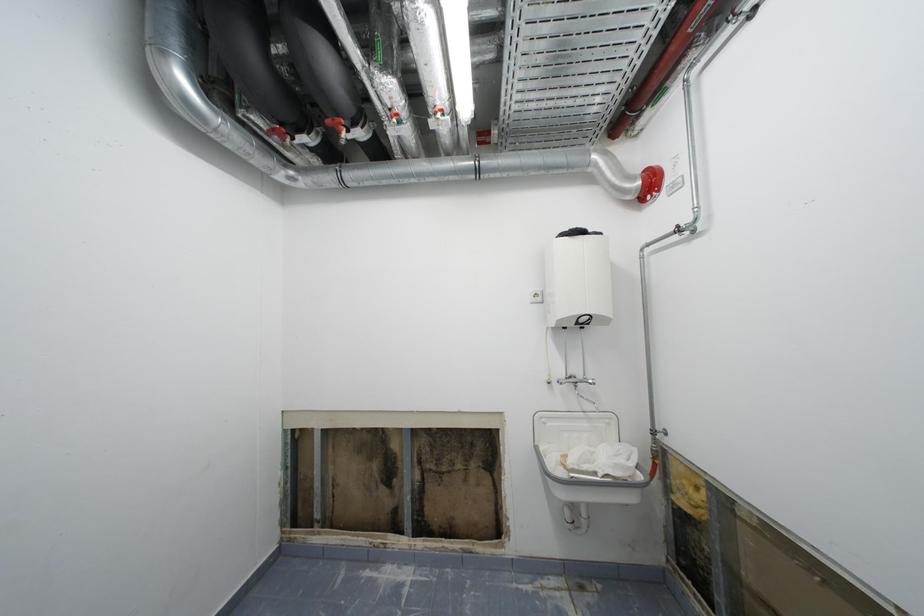
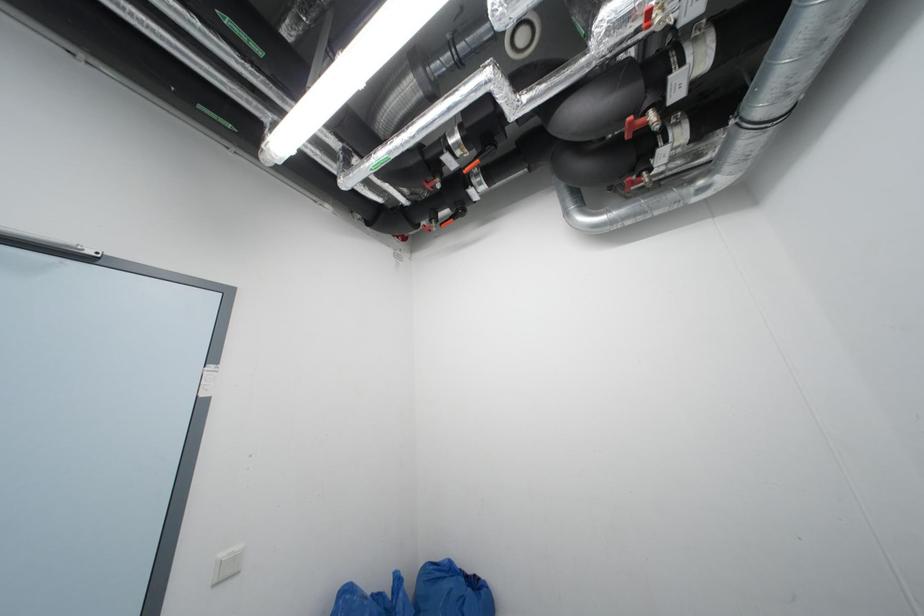
The first image is from the beginning of the video and the second image is from the end. How did the camera likely rotate when shooting the video?

The camera rotated toward left-up.